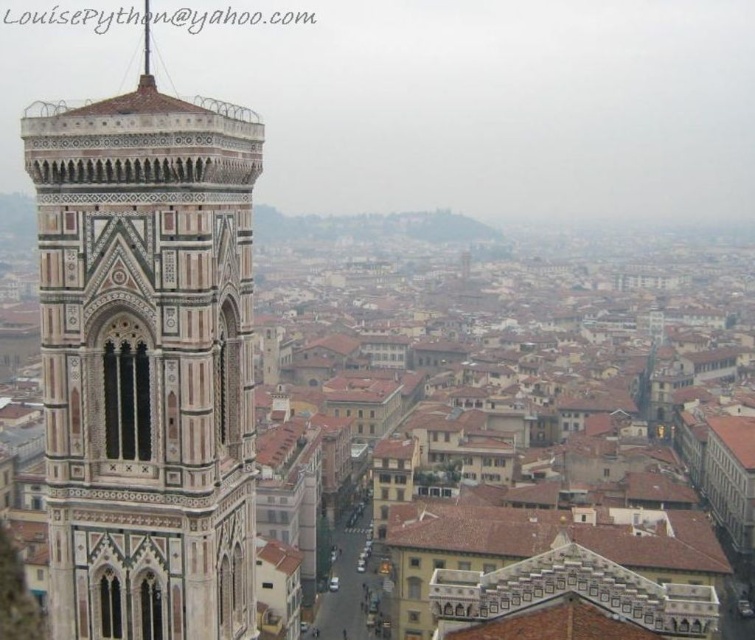
Question: Does marble mosaic bell tower at left appear under polished silver spire at upper center?

Choices:
 (A) no
 (B) yes

Answer: (B)

Question: Among these points, which one is farthest from the camera?

Choices:
 (A) (128, 461)
 (B) (148, 33)

Answer: (B)

Question: Is marble mosaic bell tower at left further to camera compared to polished silver spire at upper center?

Choices:
 (A) yes
 (B) no

Answer: (B)

Question: Does marble mosaic bell tower at left appear on the left side of polished silver spire at upper center?

Choices:
 (A) yes
 (B) no

Answer: (B)